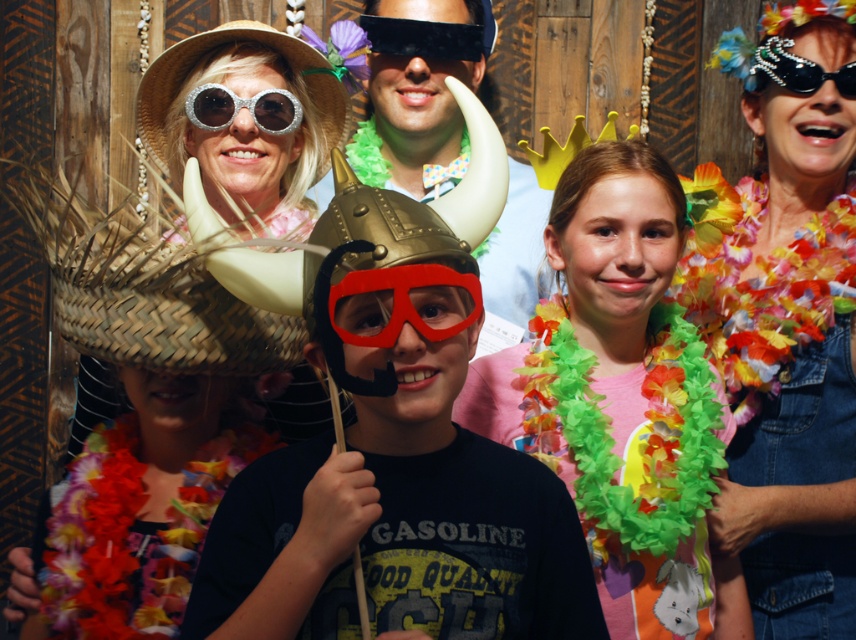
Does metallic gold helmet at center have a lesser height compared to pearl encrusted sunglasses at upper right?

Incorrect, metallic gold helmet at center's height does not fall short of pearl encrusted sunglasses at upper right's.

Between metallic gold helmet at center and pearl encrusted sunglasses at upper right, which one has more height?

metallic gold helmet at center

Is point (432, 452) positioned after point (765, 65)?

No, (432, 452) is in front of (765, 65).

The image size is (856, 640). I want to click on metallic gold helmet at center, so click(395, 461).

Is the position of metallic gold helmet at center more distant than that of black matte goggles at upper center?

A: No.

In the scene shown: Who is higher up, metallic gold helmet at center or black matte goggles at upper center?

black matte goggles at upper center is higher up.

Does point (248, 579) come behind point (394, 32)?

No.

Locate an element on the screen. The image size is (856, 640). metallic gold helmet at center is located at coordinates (395, 461).

Is metallic gold helmet at center taller than red matte goggles at center?

Indeed, metallic gold helmet at center has a greater height compared to red matte goggles at center.

Can you confirm if metallic gold helmet at center is smaller than red matte goggles at center?

Actually, metallic gold helmet at center might be larger than red matte goggles at center.

Identify the location of metallic gold helmet at center. Image resolution: width=856 pixels, height=640 pixels. (395, 461).